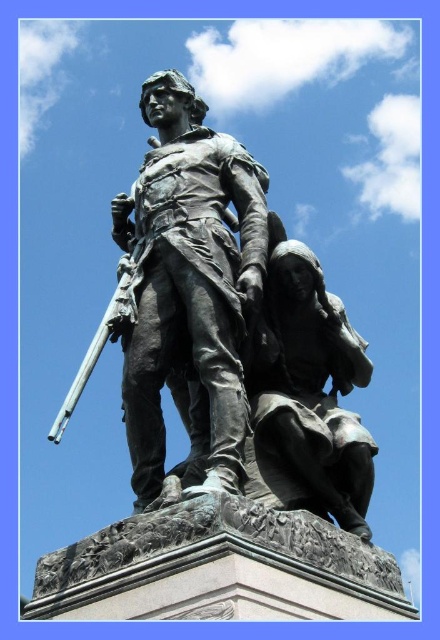
Is bronze statue at center above bronze statue at lower right?

Correct, bronze statue at center is located above bronze statue at lower right.

Can you confirm if bronze statue at center is positioned to the left of bronze statue at lower right?

Yes, bronze statue at center is to the left of bronze statue at lower right.

Is point (245, 428) more distant than point (363, 486)?

That is False.

Find the location of a particular element. This screenshot has height=640, width=440. bronze statue at center is located at coordinates (189, 282).